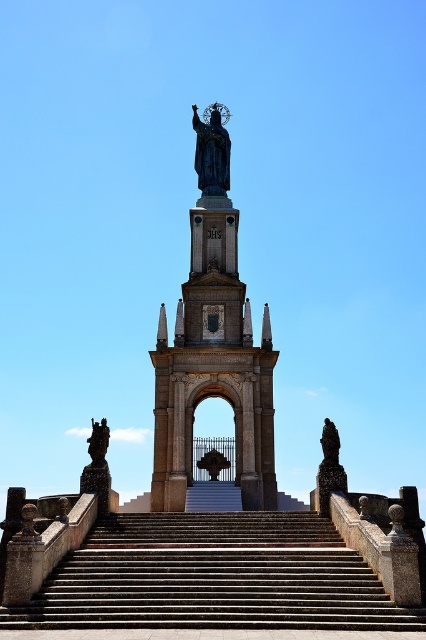
Question: Is smooth stone stairs at center smaller than polished bronze statue at center?

Choices:
 (A) no
 (B) yes

Answer: (A)

Question: Can you confirm if bronze statue at center is positioned below bronze statue at left?

Choices:
 (A) yes
 (B) no

Answer: (B)

Question: Does bronze statue at center appear under polished bronze statue at center?

Choices:
 (A) yes
 (B) no

Answer: (A)

Question: Among these objects, which one is nearest to the camera?

Choices:
 (A) polished bronze statue at center
 (B) bronze statue at left
 (C) bronze statue at center
 (D) bronze statue at right

Answer: (D)

Question: Which point appears farthest from the camera in this image?

Choices:
 (A) (224, 122)
 (B) (103, 454)

Answer: (A)

Question: Based on their relative distances, which object is nearer to the bronze statue at right?

Choices:
 (A) polished bronze statue at center
 (B) bronze statue at center
 (C) smooth stone stairs at center
 (D) bronze statue at left

Answer: (C)